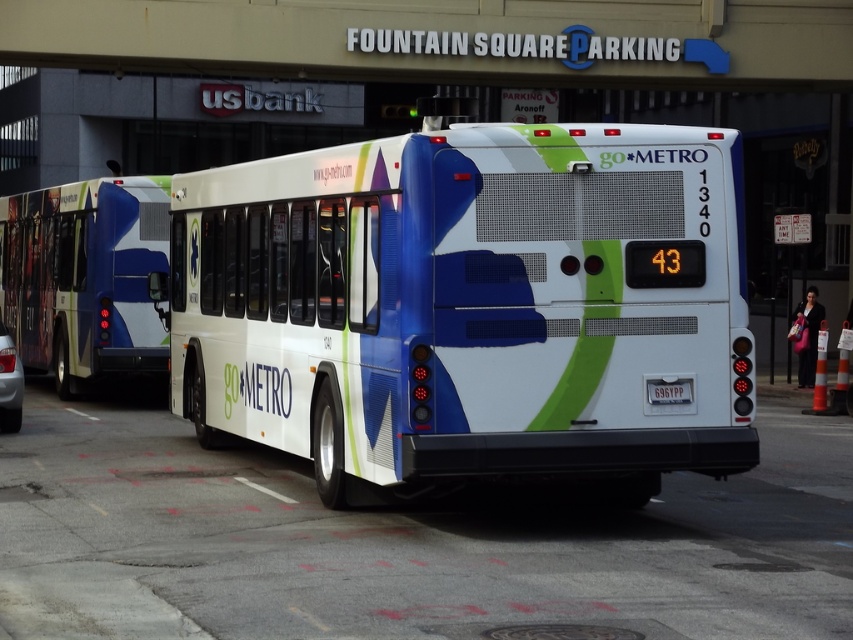
Question: Can you confirm if white glossy bus at center is bigger than black plastic license plate at center?

Choices:
 (A) yes
 (B) no

Answer: (A)

Question: Considering the real-world distances, which object is closest to the white glossy bus at center?

Choices:
 (A) black plastic license plate at center
 (B) metallic silver car at left
 (C) matte blue bus at left

Answer: (A)

Question: Estimate the real-world distances between objects in this image. Which object is closer to the matte blue bus at left?

Choices:
 (A) metallic silver car at left
 (B) black plastic license plate at center
 (C) white glossy bus at center

Answer: (A)

Question: Is the position of white glossy bus at center less distant than that of matte blue bus at left?

Choices:
 (A) no
 (B) yes

Answer: (B)

Question: Which object is farther from the camera taking this photo?

Choices:
 (A) white glossy bus at center
 (B) black plastic license plate at center

Answer: (B)

Question: Can you confirm if white glossy bus at center is thinner than black plastic license plate at center?

Choices:
 (A) no
 (B) yes

Answer: (B)